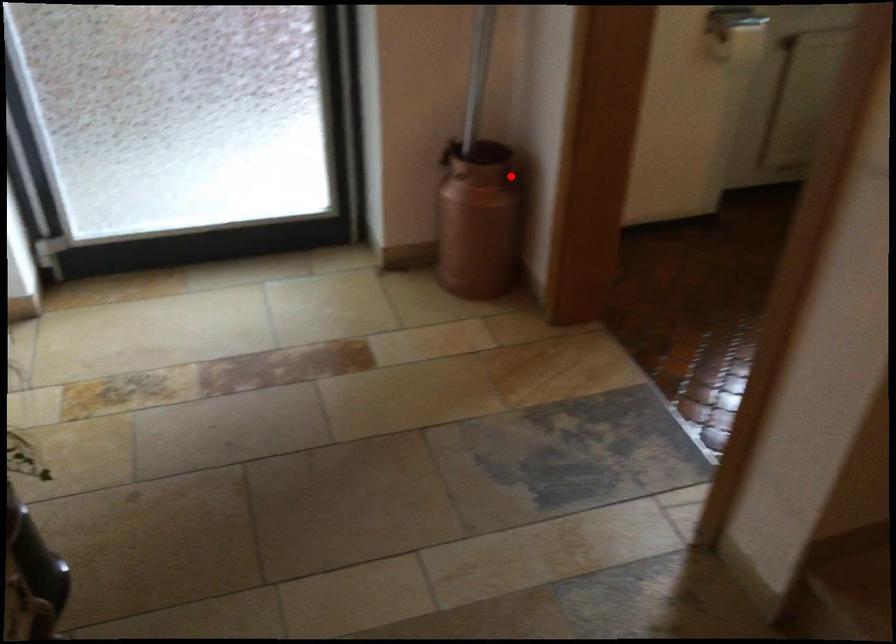
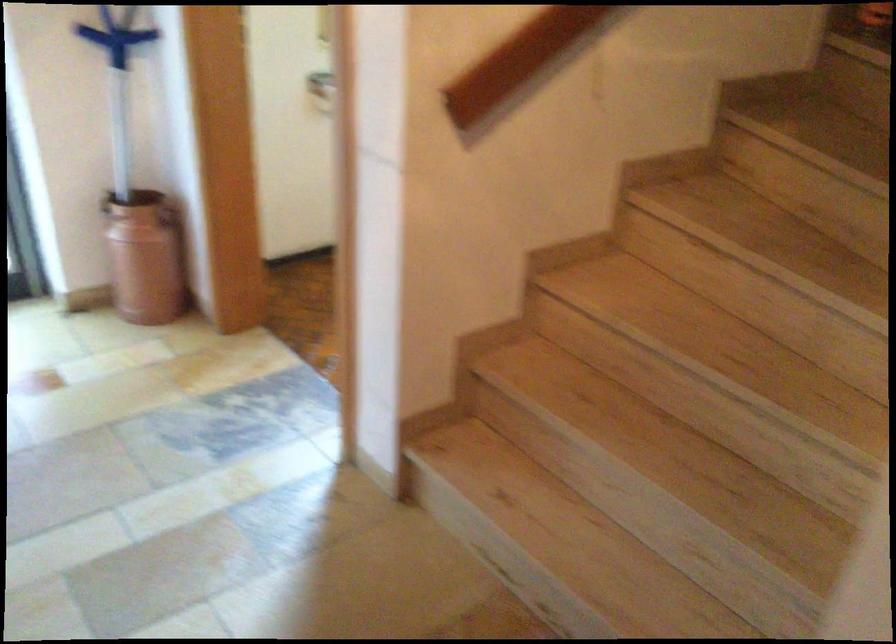
Question: I am providing you with two images of the same scene from different viewpoints. A red point is shown in image1. For the corresponding object point in image2, is it positioned nearer or farther from the camera?

Choices:
 (A) Nearer
 (B) Farther

Answer: (B)